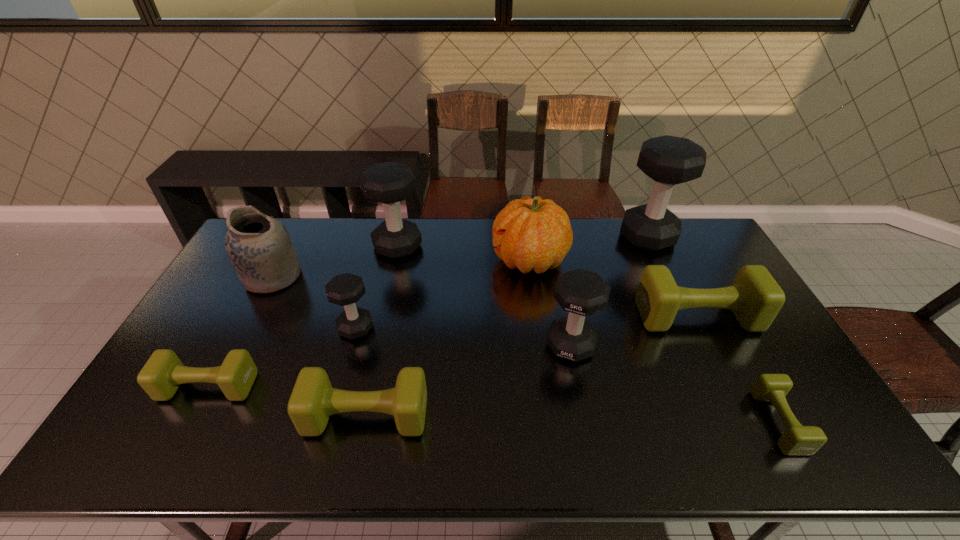
The height and width of the screenshot is (540, 960). I want to click on the fourth closest dumbbell to the pottery, so click(x=313, y=399).

I want to click on gray dumbbell that is the third closest to the pottery, so click(580, 292).

Image resolution: width=960 pixels, height=540 pixels. I want to click on gray dumbbell that can be found as the second closest to the smallest gray dumbbell, so click(580, 292).

Identify which olive dumbbell is the fourth closest to the third tallest dumbbell. Please provide its 2D coordinates. Your answer should be formatted as a tuple, i.e. [(x, y)], where the tuple contains the x and y coordinates of a point satisfying the conditions above.

[(161, 376)]

Identify which olive dumbbell is the fourth nearest to the pumpkin. Please provide its 2D coordinates. Your answer should be formatted as a tuple, i.e. [(x, y)], where the tuple contains the x and y coordinates of a point satisfying the conditions above.

[(161, 376)]

This screenshot has width=960, height=540. I want to click on free spot that satisfies the following two spatial constraints: 1. on the front side of the fifth tallest dumbbell; 2. on the left side of the pottery, so (x=252, y=316).

What are the coordinates of `free region that satisfies the following two spatial constraints: 1. on the back side of the leftmost dumbbell; 2. on the right side of the seventh shortest dumbbell` in the screenshot? It's located at (284, 246).

This screenshot has width=960, height=540. Find the location of `free space in the image that satisfies the following two spatial constraints: 1. on the front side of the leftmost dumbbell; 2. on the left side of the third smallest olive dumbbell`. free space in the image that satisfies the following two spatial constraints: 1. on the front side of the leftmost dumbbell; 2. on the left side of the third smallest olive dumbbell is located at coordinates (193, 416).

Locate an element on the screen. This screenshot has width=960, height=540. vacant position in the image that satisfies the following two spatial constraints: 1. on the carved face of the orange pumpkin; 2. on the right side of the third biggest gray dumbbell is located at coordinates (540, 345).

Find the location of a particular element. vacant region that satisfies the following two spatial constraints: 1. on the carved face of the sixth shortest dumbbell; 2. on the right side of the orange pumpkin is located at coordinates (540, 345).